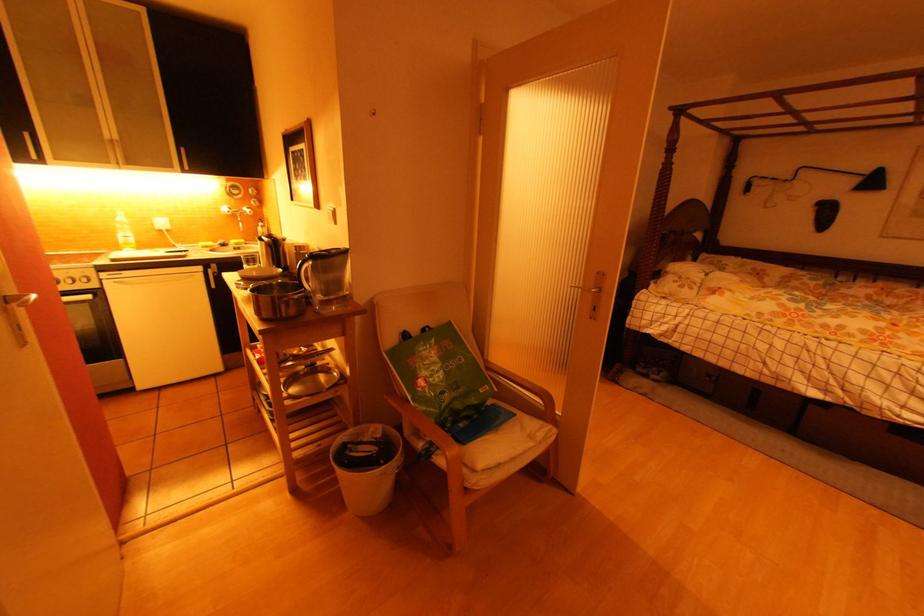
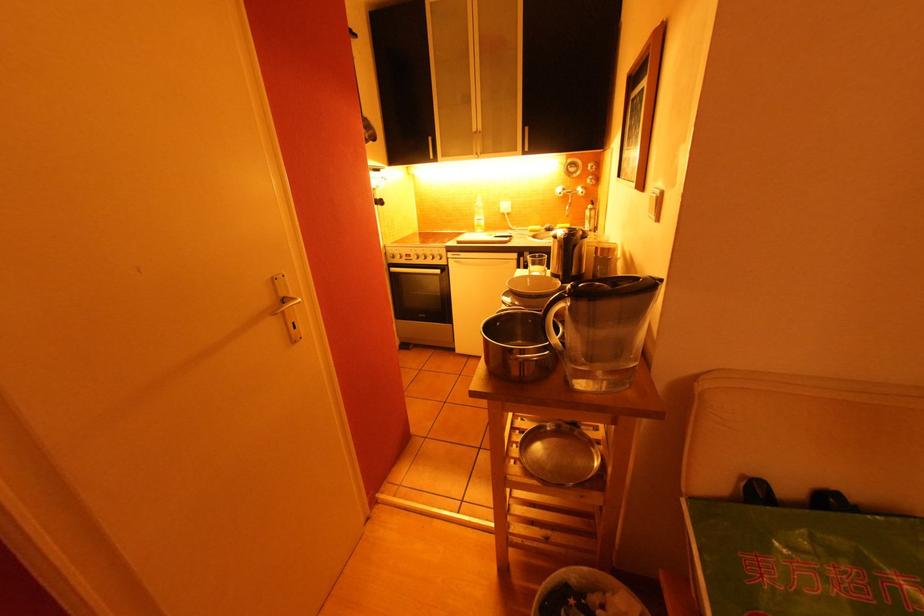
Where in the second image is the point corresponding to point 124,227 from the first image?

(481, 211)